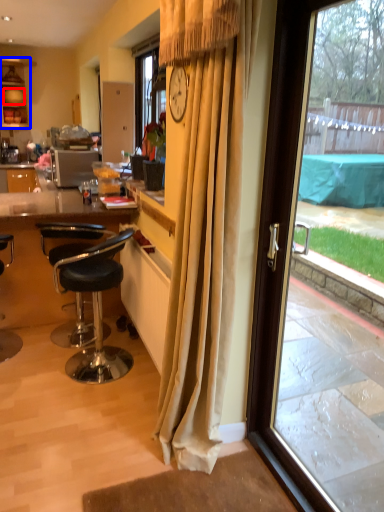
Question: Which object appears closest to the camera in this image, plate (highlighted by a red box) or cabinetry (highlighted by a blue box)?

Choices:
 (A) plate
 (B) cabinetry

Answer: (B)